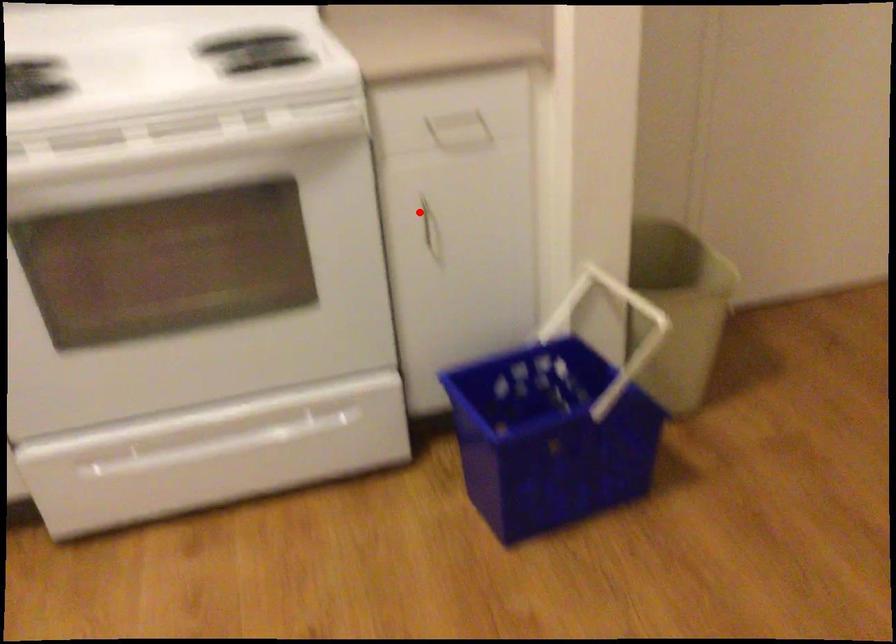
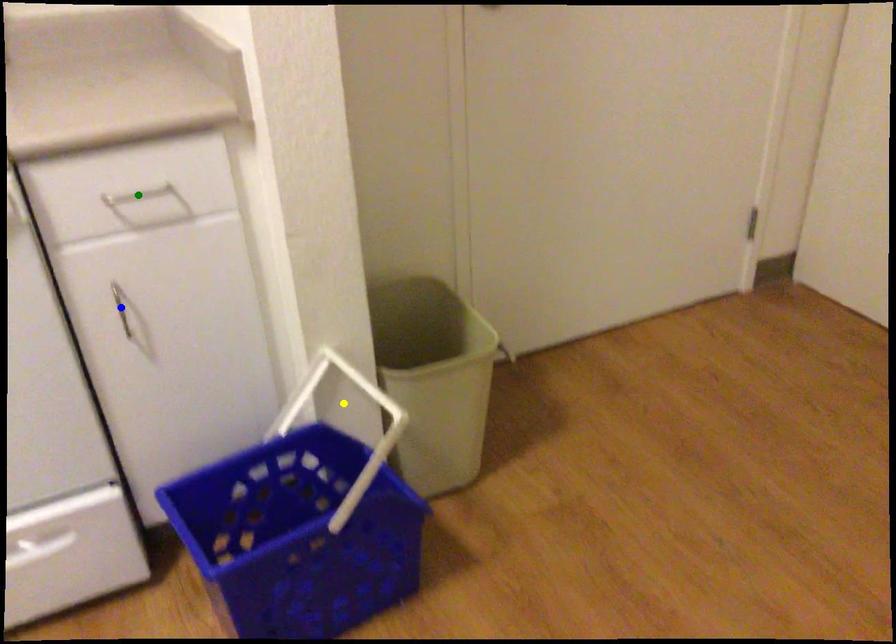
Question: I am providing you with two images of the same scene from different viewpoints. A red point is marked on the first image. You are given multiple points on the second image. Can you choose the point in image 2 that corresponds to the point in image 1?

Choices:
 (A) yellow point
 (B) green point
 (C) blue point

Answer: (C)